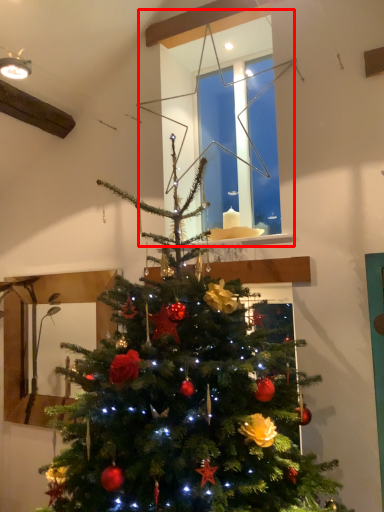
Question: Where is window (annotated by the red box) located in relation to christmas tree in the image?

Choices:
 (A) right
 (B) left

Answer: (A)